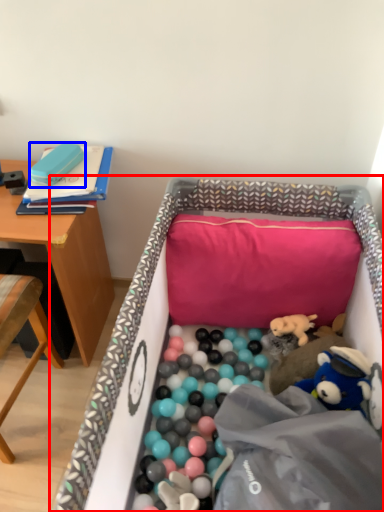
Question: Among these objects, which one is nearest to the camera, infant bed (highlighted by a red box) or toy (highlighted by a blue box)?

Choices:
 (A) infant bed
 (B) toy

Answer: (A)